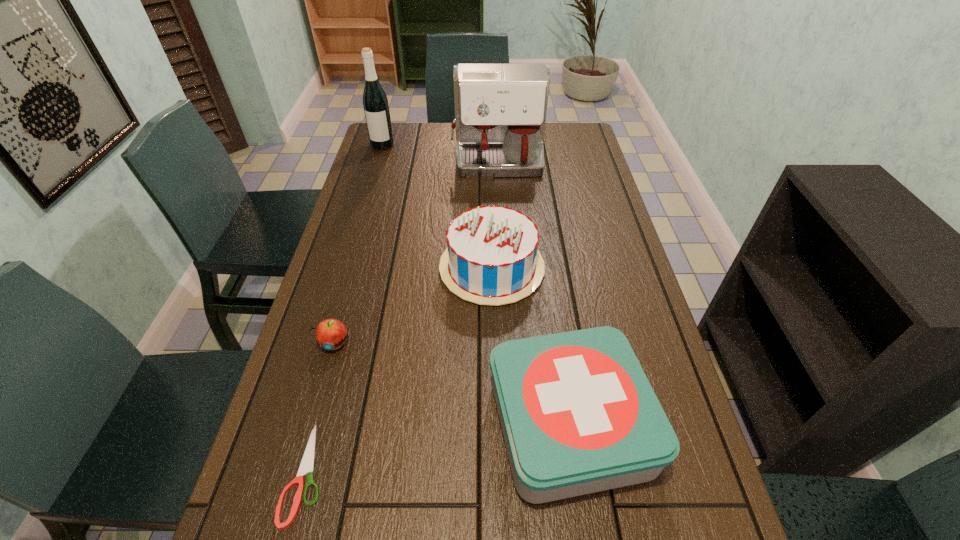
Where is `blank space located on the back of the third tallest object`? blank space located on the back of the third tallest object is located at coordinates (491, 223).

Locate an element on the screen. This screenshot has height=540, width=960. free point located on the left of the first-aid kit is located at coordinates (451, 424).

The width and height of the screenshot is (960, 540). In order to click on vacant position located 0.300m on the back of the fourth farthest object in this screenshot , I will do `click(360, 249)`.

Image resolution: width=960 pixels, height=540 pixels. I want to click on vacant position located on the back of the scissors, so click(350, 307).

Where is `wine bottle that is at the far edge`? wine bottle that is at the far edge is located at coordinates (375, 103).

This screenshot has width=960, height=540. I want to click on coffee maker present at the far edge, so click(500, 109).

Identify the location of wine bottle present at the left edge. (375, 103).

The height and width of the screenshot is (540, 960). Identify the location of apple situated at the left edge. 330,334.

Locate an element on the screen. This screenshot has height=540, width=960. scissors located in the left edge section of the desktop is located at coordinates (307, 464).

The height and width of the screenshot is (540, 960). What are the coordinates of `object situated at the right edge` in the screenshot? It's located at (578, 415).